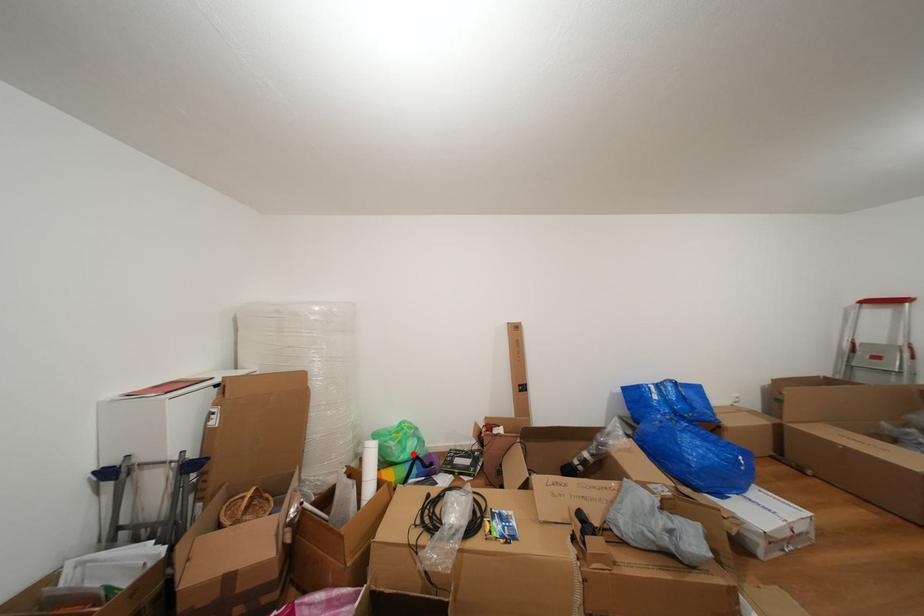
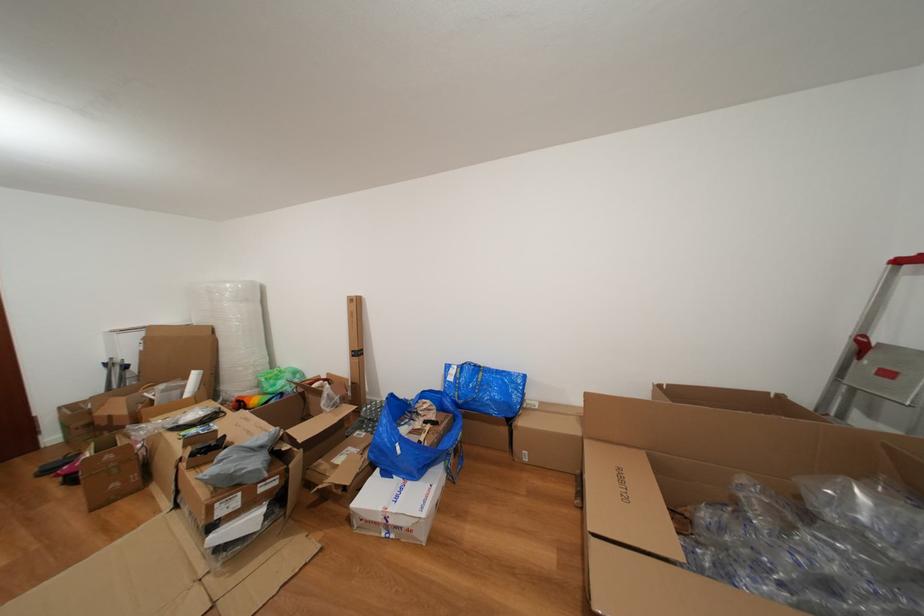
Locate, in the second image, the point that corresponds to the highlighted location in the first image.

(283, 390)